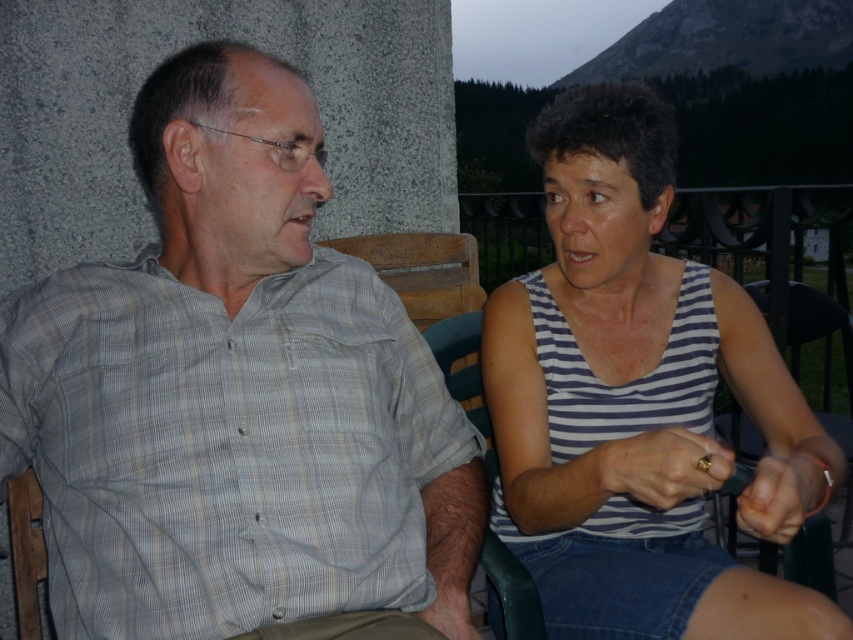
You are standing at the point labeled point (57, 472) and want to walk to the point labeled point (524, 529). Based on the scene description, will you have to walk towards the background or towards the foreground?

Since point (57, 472) is in front of point (524, 529), you will have to walk towards the background to reach point (524, 529).

You are standing in the image and see the point at coordinates (235, 394). Which object from the scene does this point lie on?

The point at coordinates (235, 394) lies on the gray plaid shirt at left.